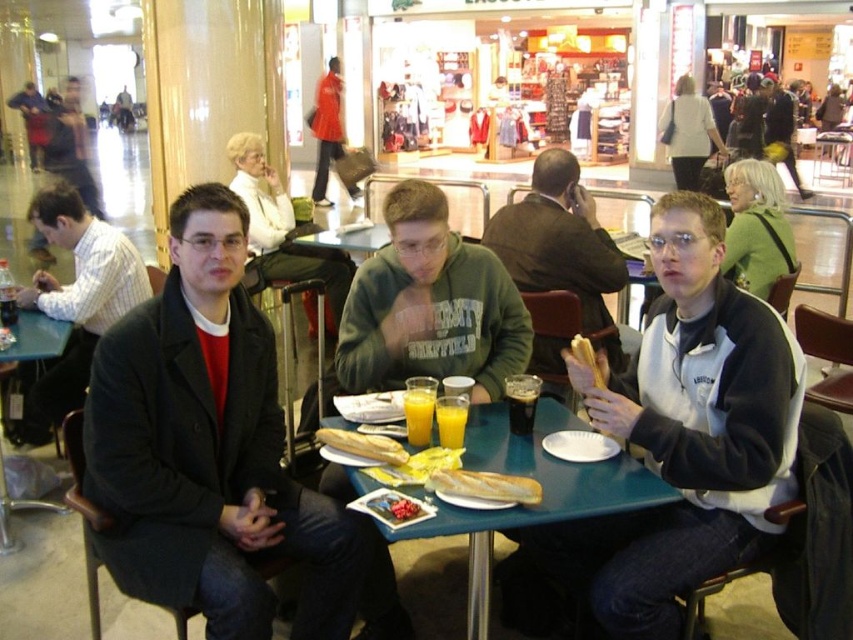
Question: Among these points, which one is farthest from the camera?

Choices:
 (A) (460, 436)
 (B) (697, 204)
 (C) (489, 385)
 (D) (618, 273)

Answer: (D)

Question: Among these points, which one is farthest from the camera?

Choices:
 (A) (529, 428)
 (B) (461, 444)

Answer: (A)

Question: Which of these objects is positioned farthest from the dark glass beverage at table center?

Choices:
 (A) green plastic table at center
 (B) smooth white bread at center
 (C) golden crusty baguette at table center

Answer: (B)

Question: Is matte black jacket at center to the right of matte black jacket at upper left from the viewer's perspective?

Choices:
 (A) yes
 (B) no

Answer: (A)

Question: Is white bread at table center behind smooth white bread at center?

Choices:
 (A) yes
 (B) no

Answer: (A)

Question: In this image, where is matte black jacket at upper left located relative to orange liquid glass at table center?

Choices:
 (A) below
 (B) above

Answer: (B)